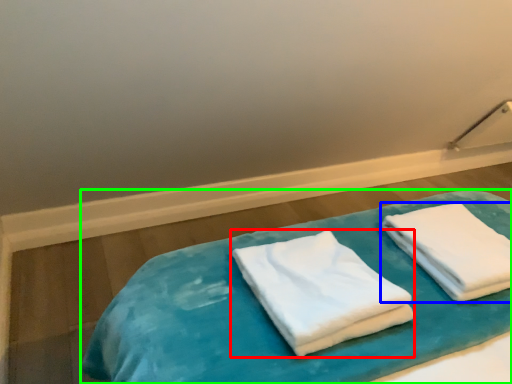
Question: Estimate the real-world distances between objects in this image. Which object is closer to towel (highlighted by a red box), towel (highlighted by a blue box) or bed (highlighted by a green box)?

Choices:
 (A) towel
 (B) bed

Answer: (B)